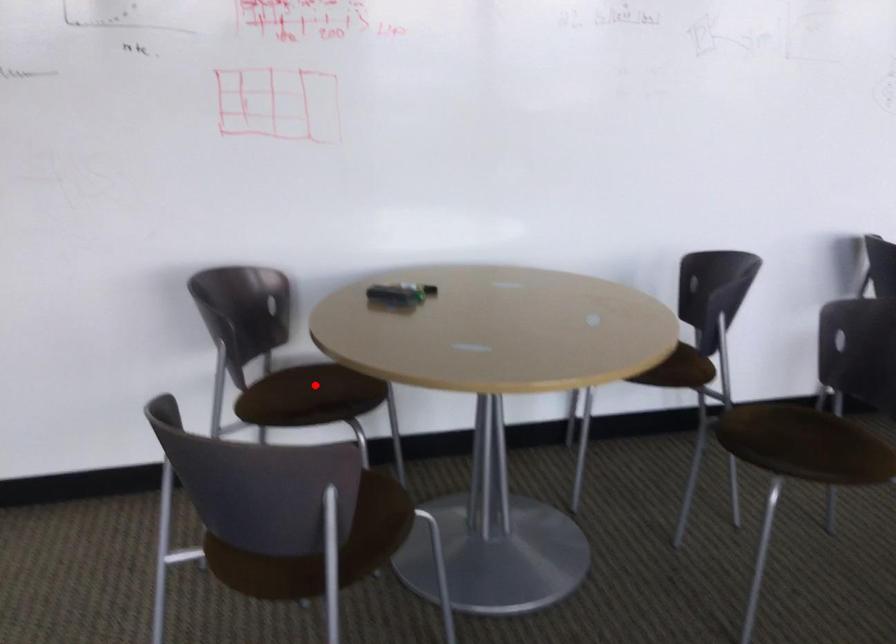
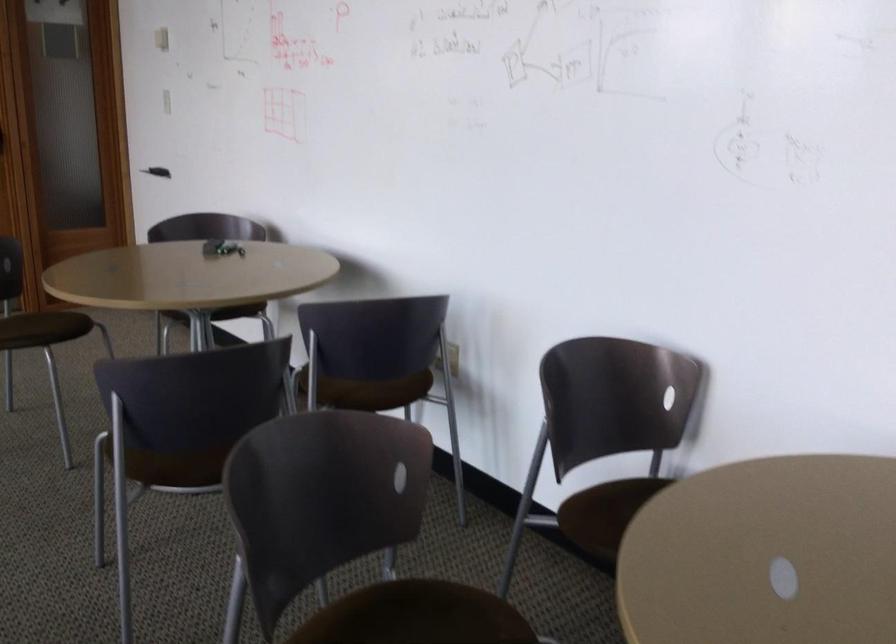
Question: I am providing you with two images of the same scene from different viewpoints. A red point is marked on the first image. At the location where the point appears in image 1, is it still visible in image 2?

Choices:
 (A) Yes
 (B) No

Answer: (B)